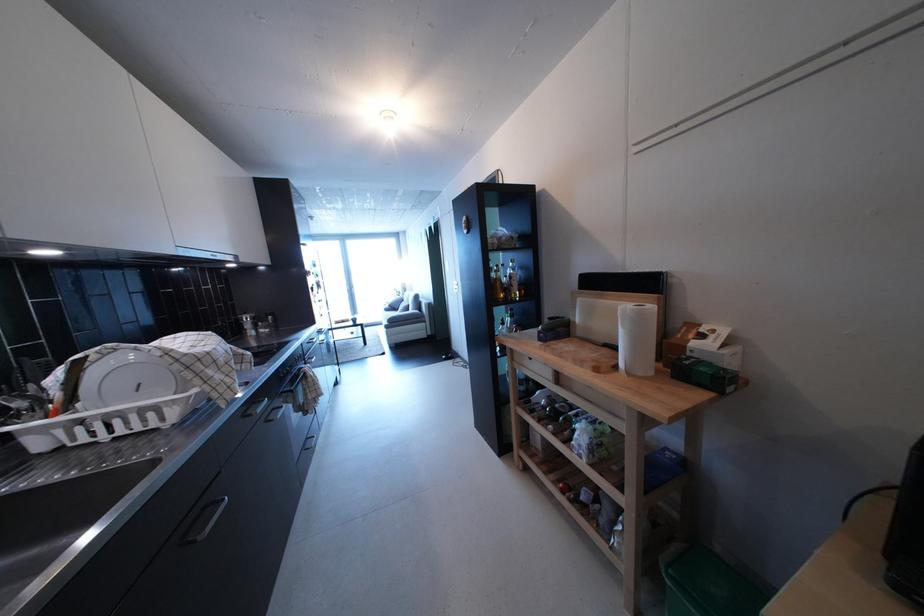
What do you see at coordinates (637, 338) in the screenshot?
I see `a white paper towel roll` at bounding box center [637, 338].